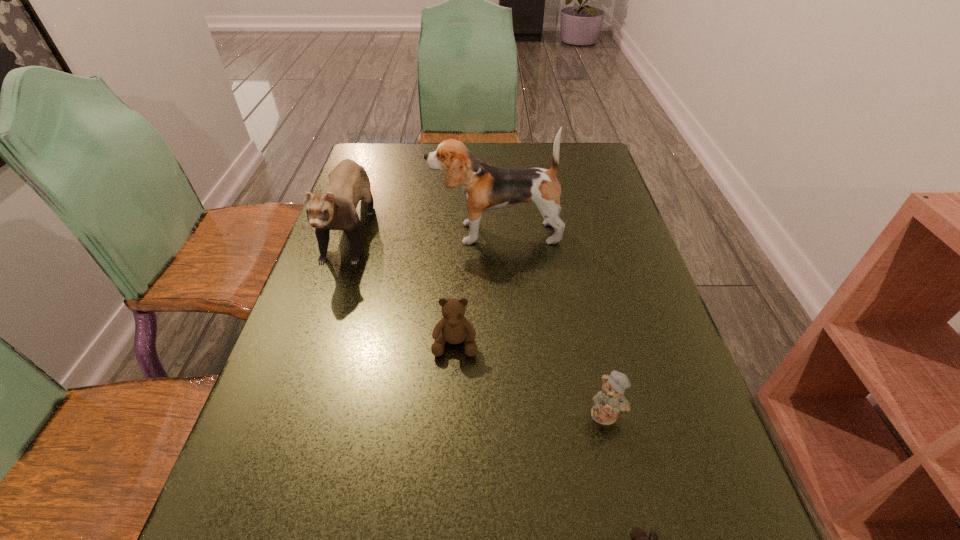
Where is `vacant space located 0.310m on the front-facing side of the third nearest object`? This screenshot has height=540, width=960. vacant space located 0.310m on the front-facing side of the third nearest object is located at coordinates [x=445, y=535].

Where is `free region located on the front-facing side of the second farthest teddy bear`? free region located on the front-facing side of the second farthest teddy bear is located at coordinates (624, 494).

Image resolution: width=960 pixels, height=540 pixels. I want to click on object positioned at the far edge, so click(x=348, y=182).

You are a GUI agent. You are given a task and a screenshot of the screen. Output one action in this format:
    pyautogui.click(x=<x>, y=<y>)
    Task: Click on the object located at the left edge
    The image size is (960, 540).
    Given the screenshot: What is the action you would take?
    348,182

This screenshot has width=960, height=540. I want to click on object that is at the right edge, so click(x=610, y=401).

Find the location of `object positioned at the far left corner`. object positioned at the far left corner is located at coordinates (348, 182).

The height and width of the screenshot is (540, 960). In the image, there is a desktop. Identify the location of blank space at the left edge. (328, 472).

The height and width of the screenshot is (540, 960). In order to click on free space at the right edge in this screenshot , I will do `click(639, 403)`.

In the image, there is a desktop. Identify the location of vacant space at the far right corner. (600, 154).

Find the location of `free space between the tallest object and the fourth farthest object`. free space between the tallest object and the fourth farthest object is located at coordinates (551, 323).